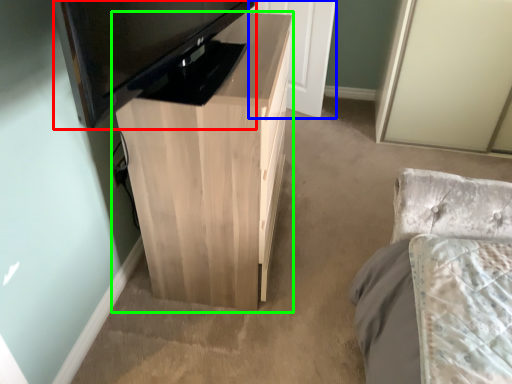
Question: Which is nearer to the television (highlighted by a red box)? door (highlighted by a blue box) or table (highlighted by a green box).

Choices:
 (A) door
 (B) table

Answer: (B)